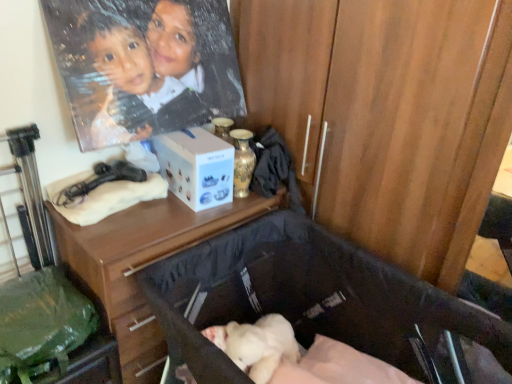
Question: Does white matte box at center have a lesser height compared to green fabric bag at lower left?

Choices:
 (A) yes
 (B) no

Answer: (A)

Question: Is white matte box at center located outside green fabric bag at lower left?

Choices:
 (A) yes
 (B) no

Answer: (A)

Question: Is the surface of white matte box at center in direct contact with green fabric bag at lower left?

Choices:
 (A) no
 (B) yes

Answer: (A)

Question: Would you consider white matte box at center to be distant from green fabric bag at lower left?

Choices:
 (A) yes
 (B) no

Answer: (B)

Question: Is white matte box at center wider than green fabric bag at lower left?

Choices:
 (A) yes
 (B) no

Answer: (B)

Question: Is wooden desk at center wider or thinner than matte black hairdryer at upper left?

Choices:
 (A) wide
 (B) thin

Answer: (A)

Question: From their relative heights in the image, would you say wooden desk at center is taller or shorter than matte black hairdryer at upper left?

Choices:
 (A) tall
 (B) short

Answer: (A)

Question: Considering the positions of point click(x=180, y=238) and point click(x=97, y=175), is point click(x=180, y=238) closer or farther from the camera than point click(x=97, y=175)?

Choices:
 (A) closer
 (B) farther

Answer: (A)

Question: From a real-world perspective, is wooden desk at center above or below matte black hairdryer at upper left?

Choices:
 (A) above
 (B) below

Answer: (B)

Question: From the image's perspective, is wooden desk at center positioned above or below green fabric bag at lower left?

Choices:
 (A) above
 (B) below

Answer: (A)

Question: From a real-world perspective, is wooden desk at center physically located above or below green fabric bag at lower left?

Choices:
 (A) above
 (B) below

Answer: (A)

Question: Is wooden desk at center inside the boundaries of green fabric bag at lower left, or outside?

Choices:
 (A) outside
 (B) inside

Answer: (A)

Question: Is wooden desk at center taller or shorter than green fabric bag at lower left?

Choices:
 (A) tall
 (B) short

Answer: (A)

Question: Is matte black hairdryer at upper left in front of or behind white matte box at center in the image?

Choices:
 (A) front
 (B) behind

Answer: (A)

Question: From their relative heights in the image, would you say matte black hairdryer at upper left is taller or shorter than white matte box at center?

Choices:
 (A) short
 (B) tall

Answer: (A)